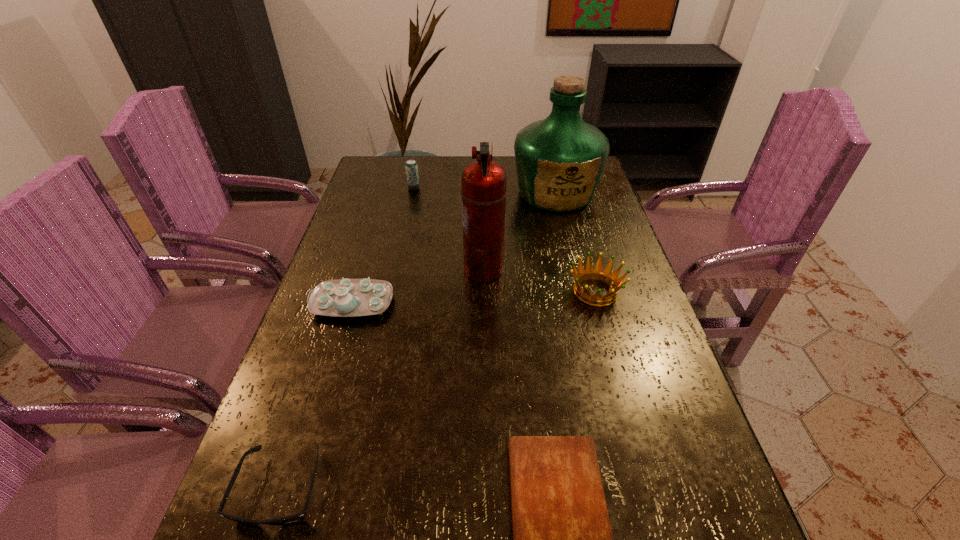
You are a GUI agent. You are given a task and a screenshot of the screen. Output one action in this format:
    pyautogui.click(x=<x>, y=<y>)
    Task: Click on the object that is the third nearest to the liquor
    Image resolution: width=960 pixels, height=540 pixels.
    Given the screenshot: What is the action you would take?
    pyautogui.click(x=411, y=167)

Where is `object that is the second closest to the chinaware`? object that is the second closest to the chinaware is located at coordinates (298, 517).

Where is `vacant space that satisfies the following two spatial constraints: 1. on the label side of the liquor; 2. on the side of the fire extinguisher with the handle and hose`? This screenshot has width=960, height=540. vacant space that satisfies the following two spatial constraints: 1. on the label side of the liquor; 2. on the side of the fire extinguisher with the handle and hose is located at coordinates (574, 269).

The height and width of the screenshot is (540, 960). What are the coordinates of `vacant position in the image that satisfies the following two spatial constraints: 1. on the label side of the liquor; 2. on the side of the fire extinguisher with the handle and hose` in the screenshot? It's located at (574, 269).

The image size is (960, 540). Identify the location of vacant space that satisfies the following two spatial constraints: 1. on the front side of the beer can; 2. on the right side of the crown. (392, 292).

Identify the location of vacant point that satisfies the following two spatial constraints: 1. on the label side of the crown; 2. on the right side of the liquor. The image size is (960, 540). (579, 292).

Where is `free space that satisfies the following two spatial constraints: 1. on the back side of the crown; 2. on the side of the fire extinguisher with the handle and hose`? This screenshot has height=540, width=960. free space that satisfies the following two spatial constraints: 1. on the back side of the crown; 2. on the side of the fire extinguisher with the handle and hose is located at coordinates (589, 269).

At what (x,y) coordinates should I click in order to perform the action: click on blank area in the image that satisfies the following two spatial constraints: 1. on the side of the fire extinguisher with the handle and hose; 2. on the front side of the chinaware. Please return your answer as a coordinate pair (x, y). Looking at the image, I should click on (484, 303).